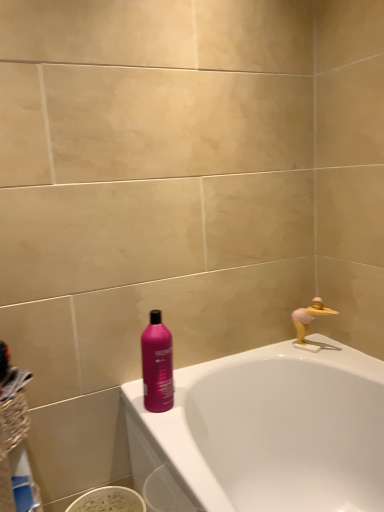
Question: Do you think matte pink bottle at center is within white glossy bathtub at upper right, or outside of it?

Choices:
 (A) outside
 (B) inside

Answer: (A)

Question: From the image's perspective, is matte pink bottle at center above or below white glossy bathtub at upper right?

Choices:
 (A) above
 (B) below

Answer: (A)

Question: Which is nearer to the white glossy bathtub at upper right?

Choices:
 (A) blue plastic bottle at lower left
 (B) yellow rubber duck at upper right
 (C) matte pink bottle at center

Answer: (B)

Question: Which of these objects is positioned closest to the blue plastic bottle at lower left?

Choices:
 (A) yellow rubber duck at upper right
 (B) white glossy bathtub at upper right
 (C) matte pink bottle at center

Answer: (C)